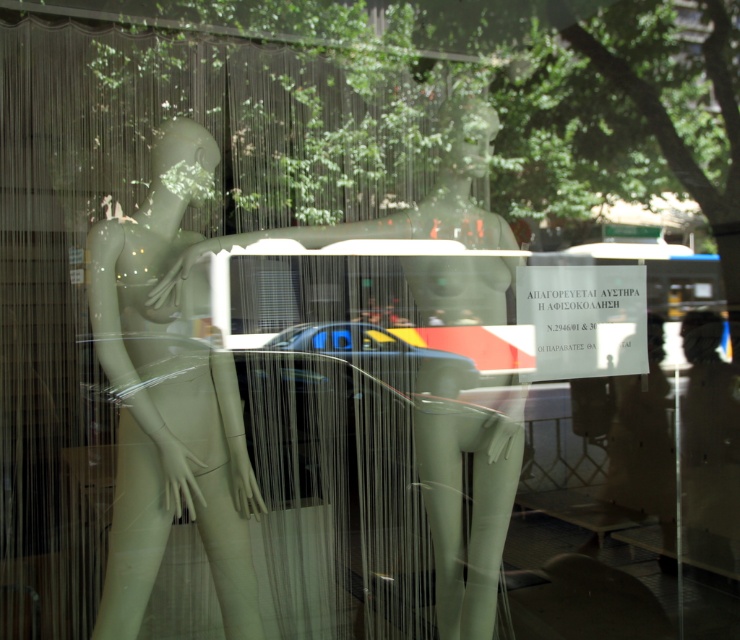
Question: Which of the following is the farthest from the observer?

Choices:
 (A) (189, 248)
 (B) (111, 545)

Answer: (B)

Question: Is matte white mannequin at left above matte white mannequin at center?

Choices:
 (A) no
 (B) yes

Answer: (B)

Question: Does matte white mannequin at left have a smaller size compared to matte white mannequin at center?

Choices:
 (A) no
 (B) yes

Answer: (B)

Question: Which object appears closest to the camera in this image?

Choices:
 (A) matte white mannequin at left
 (B) matte white mannequin at center

Answer: (A)

Question: From the image, what is the correct spatial relationship of matte white mannequin at left in relation to matte white mannequin at center?

Choices:
 (A) right
 (B) left

Answer: (B)